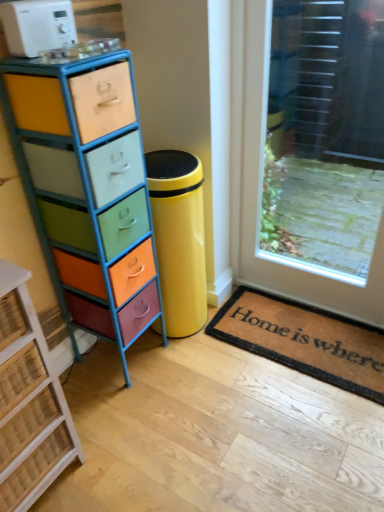
Locate an element on the screen. spots to the right of rustic wicker chest of drawers at left, the second chest of drawers from the right is located at coordinates (119, 449).